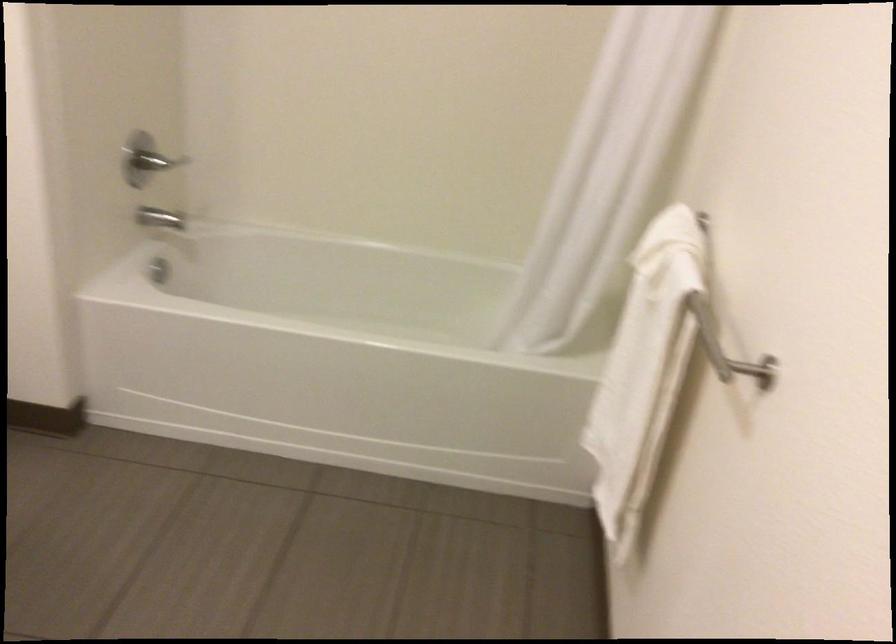
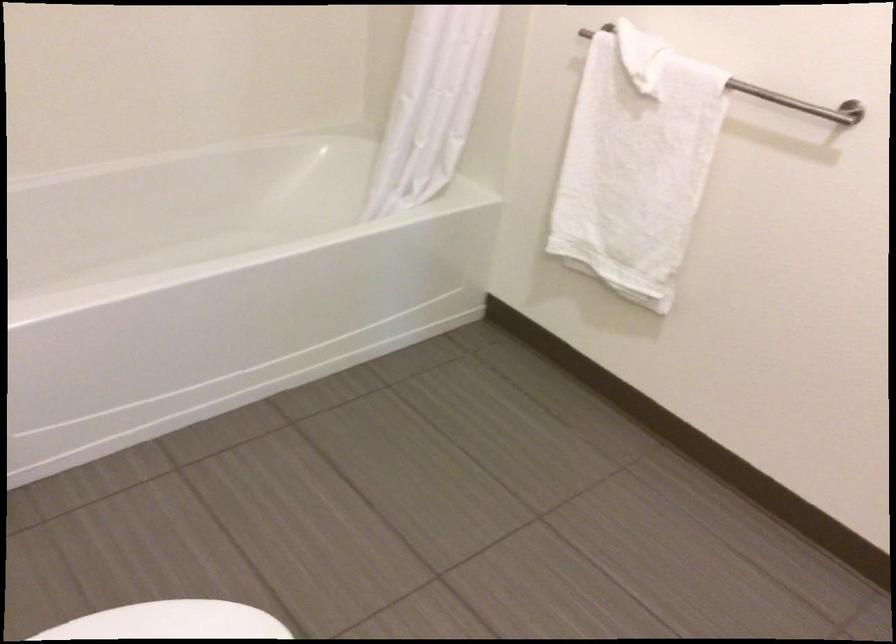
Find the pixel in the second image that matches [583,265] in the first image.

(431, 105)